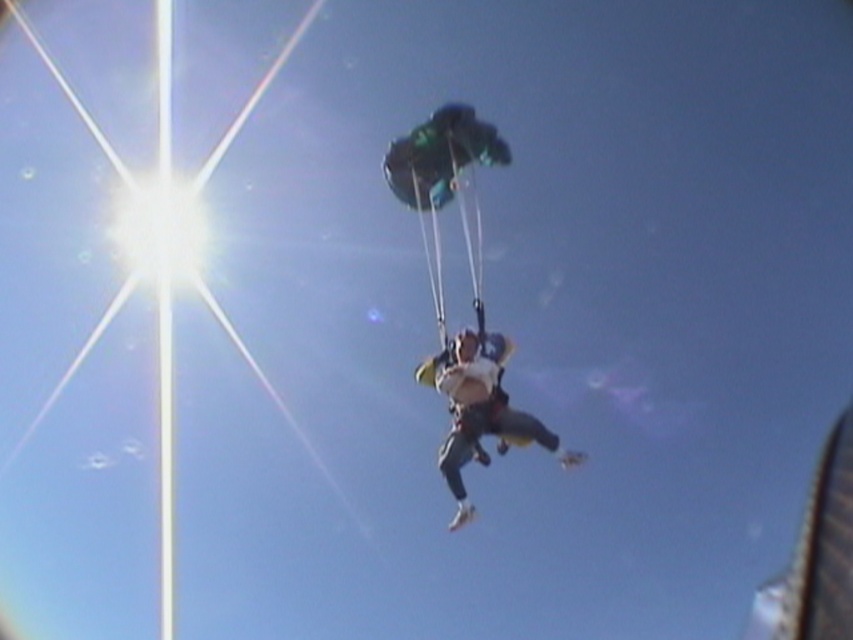
Question: Is green fabric parachute at center closer to the viewer compared to white fabric parachute at center?

Choices:
 (A) no
 (B) yes

Answer: (A)

Question: Does green fabric parachute at center have a lesser width compared to white fabric parachute at center?

Choices:
 (A) yes
 (B) no

Answer: (A)

Question: Which point is farther to the camera?

Choices:
 (A) white fabric parachute at center
 (B) green fabric parachute at center

Answer: (B)

Question: Is green fabric parachute at center wider than white fabric parachute at center?

Choices:
 (A) yes
 (B) no

Answer: (B)

Question: Among these points, which one is farthest from the camera?

Choices:
 (A) (547, 433)
 (B) (410, 208)

Answer: (B)

Question: Which object is farther from the camera taking this photo?

Choices:
 (A) white fabric parachute at center
 (B) green fabric parachute at center

Answer: (B)